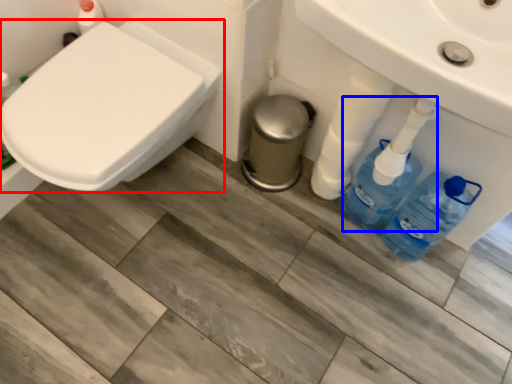
Question: Which of the following is the farthest to the observer, toilet (highlighted by a red box) or cleaning product (highlighted by a blue box)?

Choices:
 (A) toilet
 (B) cleaning product

Answer: (B)